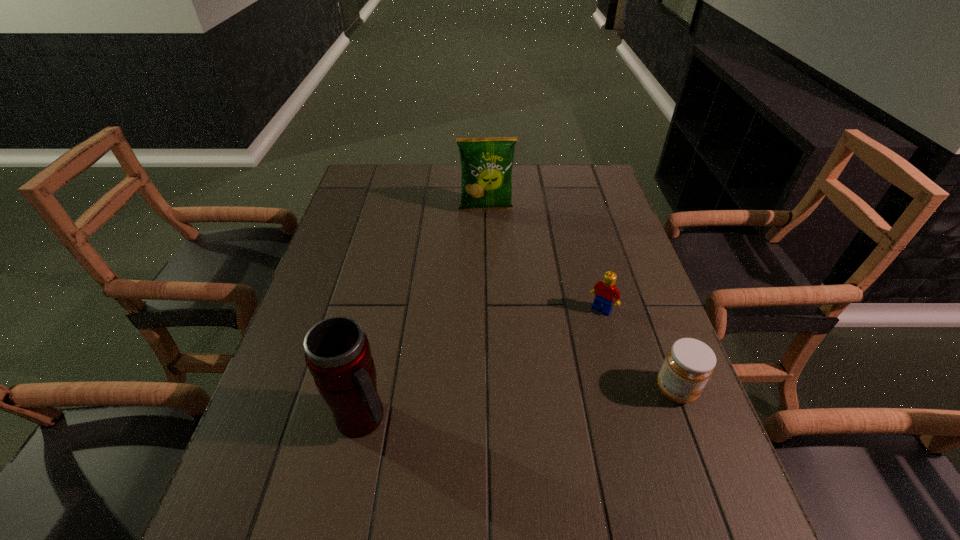
This screenshot has height=540, width=960. Find the location of `the leftmost object`. the leftmost object is located at coordinates (337, 352).

Where is `jam`? jam is located at coordinates (689, 363).

I want to click on the second farthest object, so click(x=606, y=292).

Where is `Lego`? The image size is (960, 540). Lego is located at coordinates (606, 292).

This screenshot has width=960, height=540. What are the coordinates of `crisp (potato chip)` in the screenshot? It's located at (486, 163).

Image resolution: width=960 pixels, height=540 pixels. Find the location of `the third object from right to left`. the third object from right to left is located at coordinates (486, 163).

Locate an element on the screen. The width and height of the screenshot is (960, 540). vacant point located 0.080m on the side with the handle of the thermos bottle is located at coordinates (432, 418).

You are a GUI agent. You are given a task and a screenshot of the screen. Output one action in this format:
    pyautogui.click(x=<x>, y=<y>)
    Task: Click on the free space located on the front-facing side of the Lego
    
    Given the screenshot: What is the action you would take?
    [x=569, y=353]

Locate an element on the screen. The width and height of the screenshot is (960, 540). vacant space located 0.370m on the front-facing side of the Lego is located at coordinates (515, 428).

Locate an element on the screen. vacant space located 0.150m on the front-facing side of the Lego is located at coordinates (566, 356).